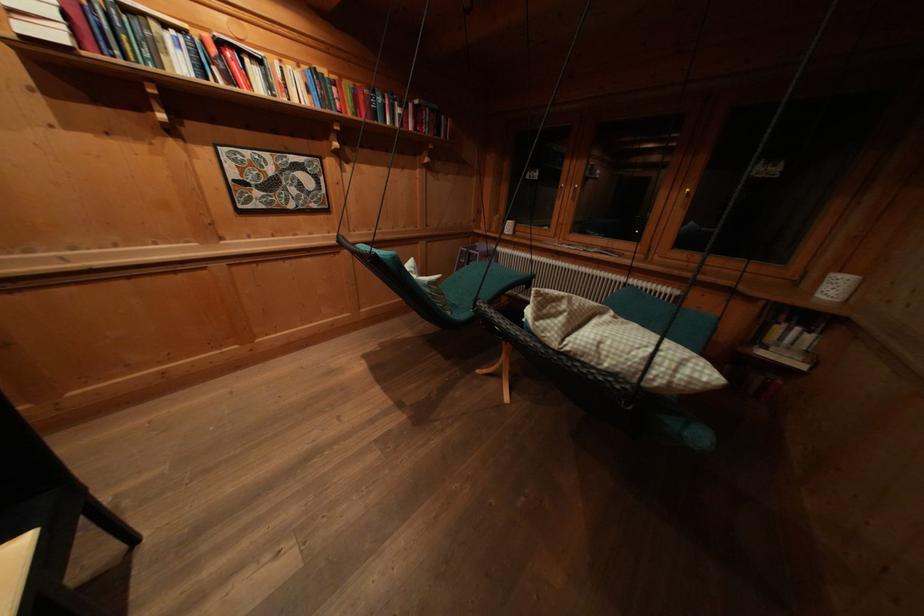
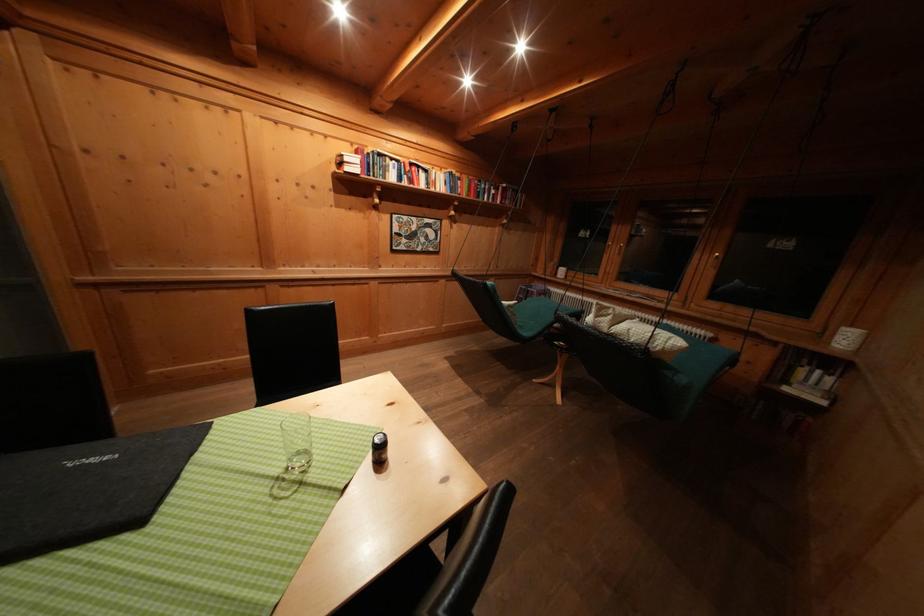
Which direction would the cameraman need to move to produce the second image?

The cameraman walked toward left, backward.